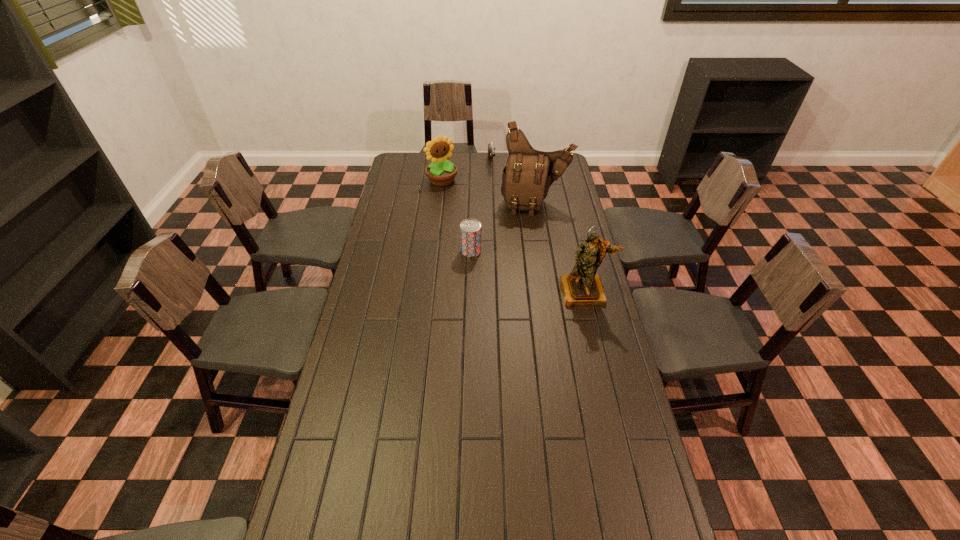
I want to click on free space that satisfies the following two spatial constraints: 1. on the back side of the third object from right to left; 2. on the left side of the beer can, so click(x=473, y=164).

You are a GUI agent. You are given a task and a screenshot of the screen. Output one action in this format:
    pyautogui.click(x=<x>, y=<y>)
    Task: Click on the blank space that satisfies the following two spatial constraints: 1. on the back side of the second object from left to right; 2. on the right side of the third object from left to right
    The height and width of the screenshot is (540, 960).
    Given the screenshot: What is the action you would take?
    pyautogui.click(x=473, y=164)